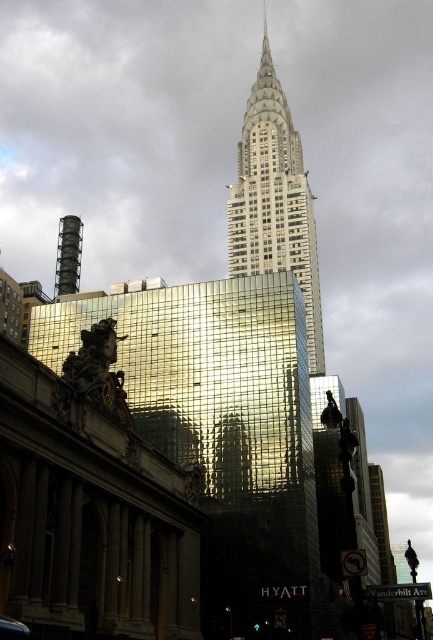
Between point (281, 586) and point (264, 58), which one is positioned behind?

The point (264, 58) is behind.

Is gold reflective glass building at center further to camera compared to white marble tower at upper center?

No, it is in front of white marble tower at upper center.

The height and width of the screenshot is (640, 433). Find the location of `gold reflective glass building at center`. gold reflective glass building at center is located at coordinates (222, 429).